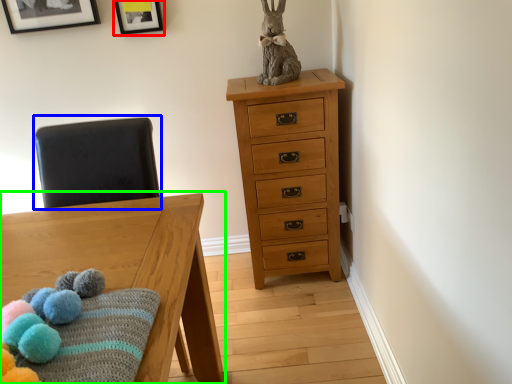
Question: Estimate the real-world distances between objects in this image. Which object is closer to picture frame (highlighted by a red box), swivel chair (highlighted by a blue box) or table (highlighted by a green box)?

Choices:
 (A) swivel chair
 (B) table

Answer: (A)